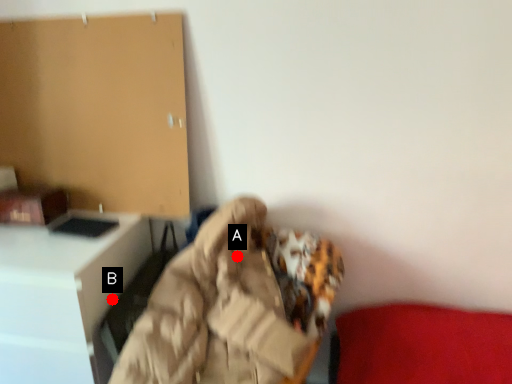
Question: Two points are circled on the image, labeled by A and B beside each circle. Which point appears farthest from the camera in this image?

Choices:
 (A) A is further
 (B) B is further

Answer: (B)